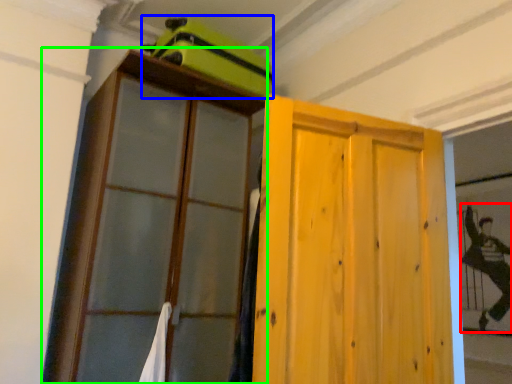
Question: Which object is positioned closest to couple (highlighted by a red box)? Select from luggage (highlighted by a blue box) and cupboard (highlighted by a green box).

Choices:
 (A) luggage
 (B) cupboard

Answer: (A)